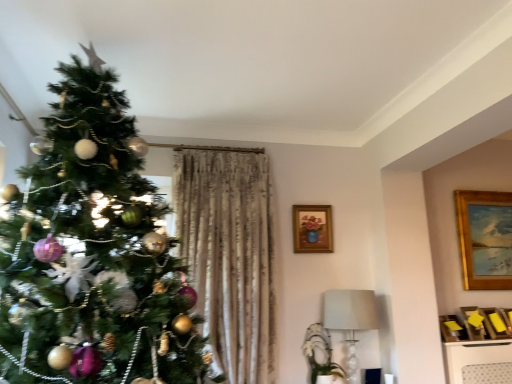
What is the approximate height of wooden frame with floral painting at upper center, placed as the 2th picture frame when sorted from right to left?

wooden frame with floral painting at upper center, placed as the 2th picture frame when sorted from right to left, is 13.54 inches in height.

Describe the element at coordinates (93, 253) in the screenshot. I see `shiny metallic ornaments at left` at that location.

Where is `wooden frame with floral painting at upper center, arranged as the 1th picture frame when viewed from the front`? The image size is (512, 384). wooden frame with floral painting at upper center, arranged as the 1th picture frame when viewed from the front is located at coordinates (312, 229).

Considering the positions of objects white fabric lampshade at lower right and shiny metallic ornaments at left in the image provided, who is in front, white fabric lampshade at lower right or shiny metallic ornaments at left?

Positioned in front is shiny metallic ornaments at left.

Is white fabric lampshade at lower right far from shiny metallic ornaments at left?

Yes, white fabric lampshade at lower right and shiny metallic ornaments at left are quite far apart.

From the image's perspective, is white fabric lampshade at lower right over shiny metallic ornaments at left?

No, from the image's perspective, white fabric lampshade at lower right is not over shiny metallic ornaments at left.

Is white fabric lampshade at lower right situated inside shiny metallic ornaments at left or outside?

white fabric lampshade at lower right exists outside the volume of shiny metallic ornaments at left.

From their relative heights in the image, would you say white fabric lampshade at lower right is taller or shorter than wooden frame with floral painting at upper center, the 1th picture frame in the left-to-right sequence?

Clearly, white fabric lampshade at lower right is taller compared to wooden frame with floral painting at upper center, the 1th picture frame in the left-to-right sequence.

How far apart are white fabric lampshade at lower right and wooden frame with floral painting at upper center, arranged as the 1th picture frame when viewed from the front?

white fabric lampshade at lower right and wooden frame with floral painting at upper center, arranged as the 1th picture frame when viewed from the front, are 18.26 inches apart from each other.

From the white fabric lampshade at lower right, count 1st picture frames backward and point to it. Please provide its 2D coordinates.

[(312, 229)]

Is white fabric lampshade at lower right facing towards wooden frame with floral painting at upper center, arranged as the 1th picture frame when viewed from the front?

No, white fabric lampshade at lower right is not aimed at wooden frame with floral painting at upper center, arranged as the 1th picture frame when viewed from the front.

Which of these two, gold wooden picture frame at upper right, marked as the second picture frame in a left-to-right arrangement, or wooden frame with floral painting at upper center, the 1th picture frame in the left-to-right sequence, is wider?

wooden frame with floral painting at upper center, the 1th picture frame in the left-to-right sequence, is wider.

Would you say gold wooden picture frame at upper right, arranged as the 2th picture frame when viewed from the front, contains wooden frame with floral painting at upper center, the 1th picture frame in the left-to-right sequence?

Actually, wooden frame with floral painting at upper center, the 1th picture frame in the left-to-right sequence, is outside gold wooden picture frame at upper right, arranged as the 2th picture frame when viewed from the front.

Is gold wooden picture frame at upper right, marked as the first picture frame in a right-to-left arrangement, not close to wooden frame with floral painting at upper center, placed as the 2th picture frame when sorted from right to left?

Indeed, gold wooden picture frame at upper right, marked as the first picture frame in a right-to-left arrangement, is not near wooden frame with floral painting at upper center, placed as the 2th picture frame when sorted from right to left.

Between gold wooden picture frame at upper right, marked as the second picture frame in a left-to-right arrangement, and wooden frame with floral painting at upper center, the 1th picture frame in the left-to-right sequence, which one appears on the left side from the viewer's perspective?

From the viewer's perspective, wooden frame with floral painting at upper center, the 1th picture frame in the left-to-right sequence, appears more on the left side.

From the image's perspective, is shiny metallic ornaments at left above or below white fabric lampshade at lower right?

From the image's perspective, shiny metallic ornaments at left appears above white fabric lampshade at lower right.

Is shiny metallic ornaments at left touching white fabric lampshade at lower right?

There is a gap between shiny metallic ornaments at left and white fabric lampshade at lower right.

Can you confirm if shiny metallic ornaments at left is thinner than white fabric lampshade at lower right?

No.

Where is `lamp behind the shiny metallic ornaments at left`? Image resolution: width=512 pixels, height=384 pixels. lamp behind the shiny metallic ornaments at left is located at coordinates (x=350, y=320).

Could you tell me if wooden frame with floral painting at upper center, placed as the 2th picture frame when sorted from right to left, is facing gold wooden picture frame at upper right, marked as the second picture frame in a left-to-right arrangement?

No.

Identify the location of picture frame above the gold wooden picture frame at upper right, which is counted as the first picture frame, starting from the back (from a real-world perspective). (312, 229).

Which of these two, wooden frame with floral painting at upper center, the 1th picture frame in the left-to-right sequence, or gold wooden picture frame at upper right, which is counted as the first picture frame, starting from the back, stands taller?

Standing taller between the two is gold wooden picture frame at upper right, which is counted as the first picture frame, starting from the back.

Considering the sizes of wooden frame with floral painting at upper center, the 1th picture frame in the left-to-right sequence, and gold wooden picture frame at upper right, marked as the first picture frame in a right-to-left arrangement, in the image, is wooden frame with floral painting at upper center, the 1th picture frame in the left-to-right sequence, wider or thinner than gold wooden picture frame at upper right, marked as the first picture frame in a right-to-left arrangement,?

In the image, wooden frame with floral painting at upper center, the 1th picture frame in the left-to-right sequence, appears to be wider than gold wooden picture frame at upper right, marked as the first picture frame in a right-to-left arrangement.

Does point (331, 235) come behind point (52, 168)?

That is True.

Would you say wooden frame with floral painting at upper center, placed as the 2th picture frame when sorted from right to left, contains shiny metallic ornaments at left?

Actually, shiny metallic ornaments at left is outside wooden frame with floral painting at upper center, placed as the 2th picture frame when sorted from right to left.

From the image's perspective, which is below, wooden frame with floral painting at upper center, arranged as the 1th picture frame when viewed from the front, or shiny metallic ornaments at left?

wooden frame with floral painting at upper center, arranged as the 1th picture frame when viewed from the front.

Is wooden frame with floral painting at upper center, which is the second picture frame from back to front, oriented away from shiny metallic ornaments at left?

wooden frame with floral painting at upper center, which is the second picture frame from back to front, does not have its back to shiny metallic ornaments at left.

In terms of height, does wooden frame with floral painting at upper center, placed as the 2th picture frame when sorted from right to left, look taller or shorter compared to white fabric lampshade at lower right?

wooden frame with floral painting at upper center, placed as the 2th picture frame when sorted from right to left, is shorter than white fabric lampshade at lower right.

In terms of size, does wooden frame with floral painting at upper center, which is the second picture frame from back to front, appear bigger or smaller than white fabric lampshade at lower right?

In the image, wooden frame with floral painting at upper center, which is the second picture frame from back to front, appears to be smaller than white fabric lampshade at lower right.

Is point (295, 226) closer to camera compared to point (353, 329)?

No, (295, 226) is behind (353, 329).

Identify the location of lamp below the shiny metallic ornaments at left (from the image's perspective). The width and height of the screenshot is (512, 384). (350, 320).

Locate an element on the screen. The width and height of the screenshot is (512, 384). lamp that is on the right side of wooden frame with floral painting at upper center, placed as the 2th picture frame when sorted from right to left is located at coordinates (x=350, y=320).

Considering their positions, is white fabric lampshade at lower right positioned further to shiny metallic ornaments at left than wooden frame with floral painting at upper center, the 1th picture frame in the left-to-right sequence?

The object further to shiny metallic ornaments at left is wooden frame with floral painting at upper center, the 1th picture frame in the left-to-right sequence.

Which object lies nearer to the anchor point white fabric lampshade at lower right, wooden frame with floral painting at upper center, placed as the 2th picture frame when sorted from right to left, or gold wooden picture frame at upper right, arranged as the 2th picture frame when viewed from the front?

Based on the image, wooden frame with floral painting at upper center, placed as the 2th picture frame when sorted from right to left, appears to be nearer to white fabric lampshade at lower right.

Looking at the image, which one is located further to wooden frame with floral painting at upper center, which is the second picture frame from back to front, shiny metallic ornaments at left or white fabric lampshade at lower right?

shiny metallic ornaments at left lies further to wooden frame with floral painting at upper center, which is the second picture frame from back to front, than the other object.

Which object lies further to the anchor point shiny metallic ornaments at left, gold wooden picture frame at upper right, marked as the second picture frame in a left-to-right arrangement, or white fabric lampshade at lower right?

gold wooden picture frame at upper right, marked as the second picture frame in a left-to-right arrangement, is further to shiny metallic ornaments at left.

Considering their positions, is white fabric lampshade at lower right positioned closer to shiny metallic ornaments at left than gold wooden picture frame at upper right, which is counted as the first picture frame, starting from the back?

Based on the image, white fabric lampshade at lower right appears to be nearer to shiny metallic ornaments at left.

Which object lies further to the anchor point wooden frame with floral painting at upper center, placed as the 2th picture frame when sorted from right to left, white fabric lampshade at lower right or gold wooden picture frame at upper right, marked as the first picture frame in a right-to-left arrangement?

Among the two, gold wooden picture frame at upper right, marked as the first picture frame in a right-to-left arrangement, is located further to wooden frame with floral painting at upper center, placed as the 2th picture frame when sorted from right to left.

From the image, which object appears to be farther from gold wooden picture frame at upper right, marked as the first picture frame in a right-to-left arrangement, shiny metallic ornaments at left or wooden frame with floral painting at upper center, placed as the 2th picture frame when sorted from right to left?

shiny metallic ornaments at left is positioned further to the anchor gold wooden picture frame at upper right, marked as the first picture frame in a right-to-left arrangement.

Considering their positions, is gold wooden picture frame at upper right, which is counted as the first picture frame, starting from the back, positioned further to white fabric lampshade at lower right than wooden frame with floral painting at upper center, which is the second picture frame from back to front?

Based on the image, gold wooden picture frame at upper right, which is counted as the first picture frame, starting from the back, appears to be further to white fabric lampshade at lower right.

The image size is (512, 384). In order to click on lamp between shiny metallic ornaments at left and wooden frame with floral painting at upper center, the 1th picture frame in the left-to-right sequence, in the front-back direction in this screenshot , I will do `click(350, 320)`.

Find the location of a particular element. This screenshot has width=512, height=384. lamp between shiny metallic ornaments at left and gold wooden picture frame at upper right, marked as the second picture frame in a left-to-right arrangement, from left to right is located at coordinates (350, 320).

Find the location of a particular element. The width and height of the screenshot is (512, 384). picture frame between shiny metallic ornaments at left and gold wooden picture frame at upper right, marked as the second picture frame in a left-to-right arrangement, from front to back is located at coordinates (312, 229).

Locate an element on the screen. This screenshot has width=512, height=384. lamp situated between wooden frame with floral painting at upper center, placed as the 2th picture frame when sorted from right to left, and gold wooden picture frame at upper right, arranged as the 2th picture frame when viewed from the front, from left to right is located at coordinates (350, 320).